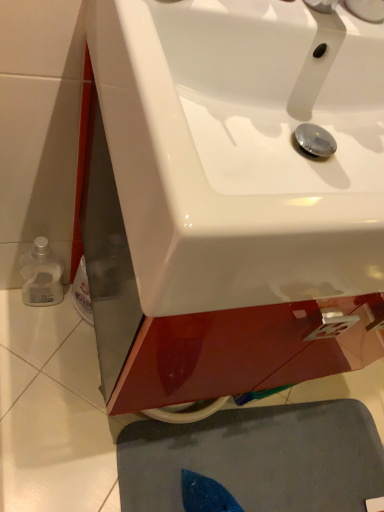
Where is `free spot above gray matte bath mat at lower center (from a real-world perspective)`? This screenshot has height=512, width=384. free spot above gray matte bath mat at lower center (from a real-world perspective) is located at coordinates (273, 461).